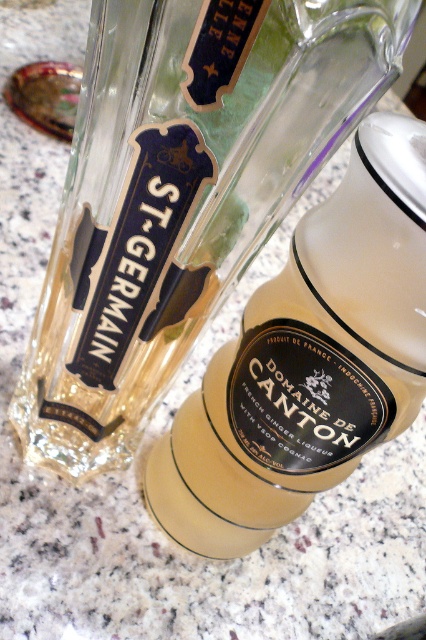
Question: Which of the following is the farthest from the observer?

Choices:
 (A) (261, 465)
 (B) (71, 244)

Answer: (A)

Question: Which object is closer to the camera taking this photo?

Choices:
 (A) translucent glass bottle at center
 (B) clear glass bottle at center

Answer: (B)

Question: Is clear glass bottle at center further to the viewer compared to translucent glass bottle at center?

Choices:
 (A) no
 (B) yes

Answer: (A)

Question: Can you confirm if clear glass bottle at center is positioned below translucent glass bottle at center?

Choices:
 (A) yes
 (B) no

Answer: (B)

Question: Does clear glass bottle at center appear over translucent glass bottle at center?

Choices:
 (A) no
 (B) yes

Answer: (B)